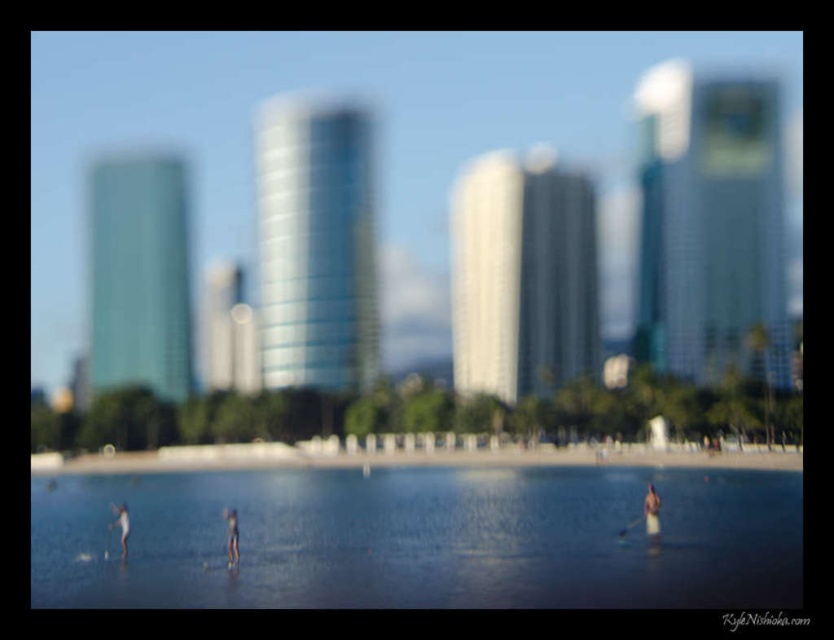
You are a photographer planning to capture a reflection shot of the waterfront scene. The clear water at center and smooth sand at lower center are both potential surfaces for reflections. Which surface would you choose to maximize the clarity of the reflection, and why?

The clear water at center is larger in size than the smooth sand at lower center, so it provides a more expansive and stable surface for capturing a clearer reflection.

You are a photographer planning to capture a reflection shot of the waterfront scene. You need to decide where to position your camera to ensure the reflection of the clear water at center is visible. According to the scene description, where should you place the camera relative to the smooth sand at lower center?

The clear water at center is located above the smooth sand at lower center, so to capture the reflection of the clear water at center, position the camera above the smooth sand at lower center.